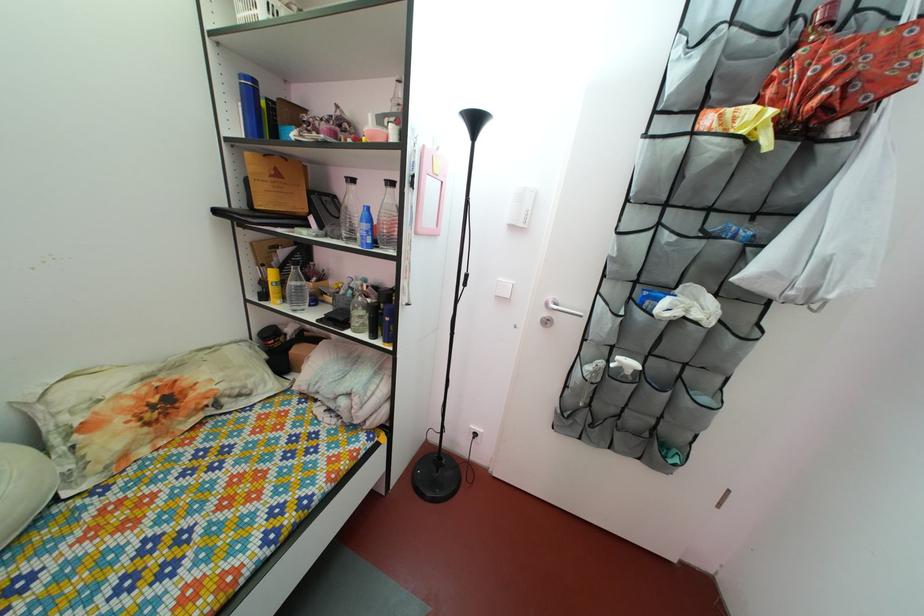
Locate an element on the screen. This screenshot has width=924, height=616. red folded umbrella is located at coordinates pos(841,74).